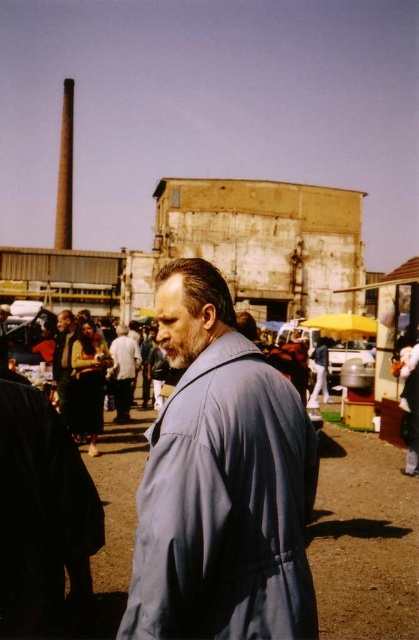
You are a tailor observing a man wearing a blue fabric coat at center and a light brown leather jacket at center. Which garment would require more fabric to make?

The blue fabric coat at center requires more fabric because it is larger in size than the light brown leather jacket at center.

You are a fashion designer observing a man wearing a blue fabric coat at center and a matte black jacket at lower left. Which clothing item appears bigger in the image?

The blue fabric coat at center has a larger size compared to the matte black jacket at lower left, so the blue fabric coat at center appears bigger in the image.

You are standing at the point marked by the coordinates point [220,481] in the image. Looking around, you see the blue fabric coat at center. What object is located directly in front of you?

The point [220,481] corresponds to the blue fabric coat at center, so the object directly in front of you is the blue fabric coat at center.